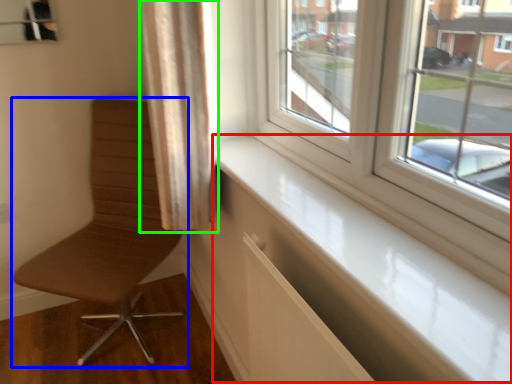
Question: Which object is positioned farthest from window sill (highlighted by a red box)? Select from chair (highlighted by a blue box) and curtain (highlighted by a green box).

Choices:
 (A) chair
 (B) curtain

Answer: (A)